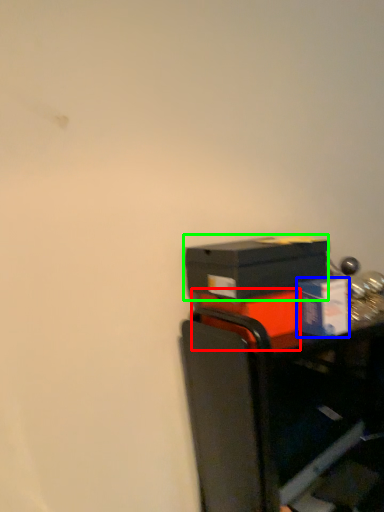
Question: Considering the real-world distances, which object is farthest from box (highlighted by a red box)? box (highlighted by a blue box) or box (highlighted by a green box)?

Choices:
 (A) box
 (B) box

Answer: (A)